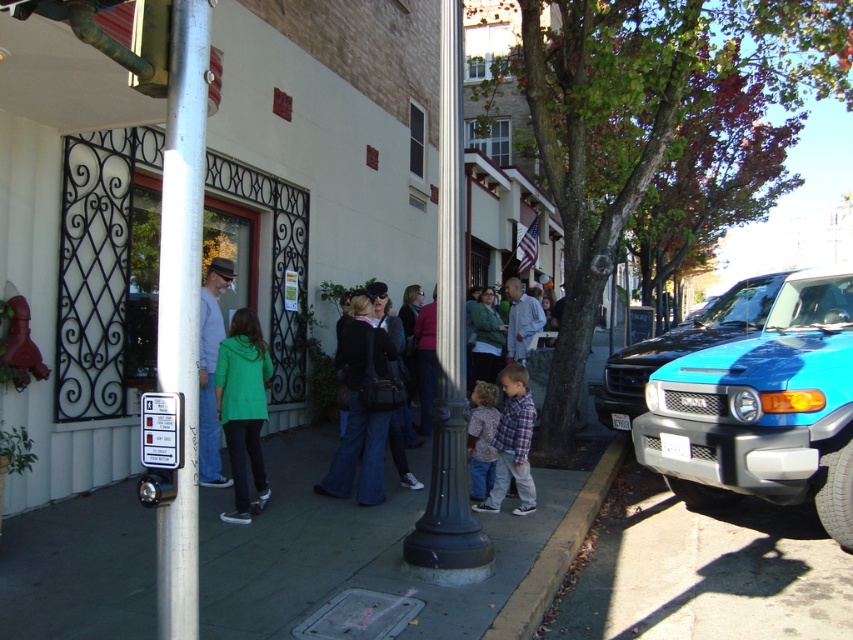
In order to click on gray concrete sidewalk at center in this screenshot , I will do `click(355, 548)`.

Who is more distant from viewer, (514, 561) or (531, 401)?

Point (531, 401)

You are a GUI agent. You are given a task and a screenshot of the screen. Output one action in this format:
    pyautogui.click(x=<x>, y=<y>)
    Task: Click on the gray concrete sidewalk at center
    
    Given the screenshot: What is the action you would take?
    pyautogui.click(x=355, y=548)

Can you confirm if brown concrete curb at lower right is positioned below plaid shirt at center?

Yes, brown concrete curb at lower right is below plaid shirt at center.

Which is below, brown concrete curb at lower right or plaid shirt at center?

Positioned lower is brown concrete curb at lower right.

The image size is (853, 640). Find the location of `brown concrete curb at lower right`. brown concrete curb at lower right is located at coordinates (556, 552).

Does silver metallic pole at center have a greater width compared to blue glossy suv at right?

Incorrect, silver metallic pole at center's width does not surpass blue glossy suv at right's.

Is silver metallic pole at center in front of blue glossy suv at right?

Yes, silver metallic pole at center is in front of blue glossy suv at right.

Which is in front, point (190, 369) or point (602, 422)?

Point (190, 369) is in front.

Find the location of a particular element. This screenshot has width=853, height=640. silver metallic pole at center is located at coordinates (181, 307).